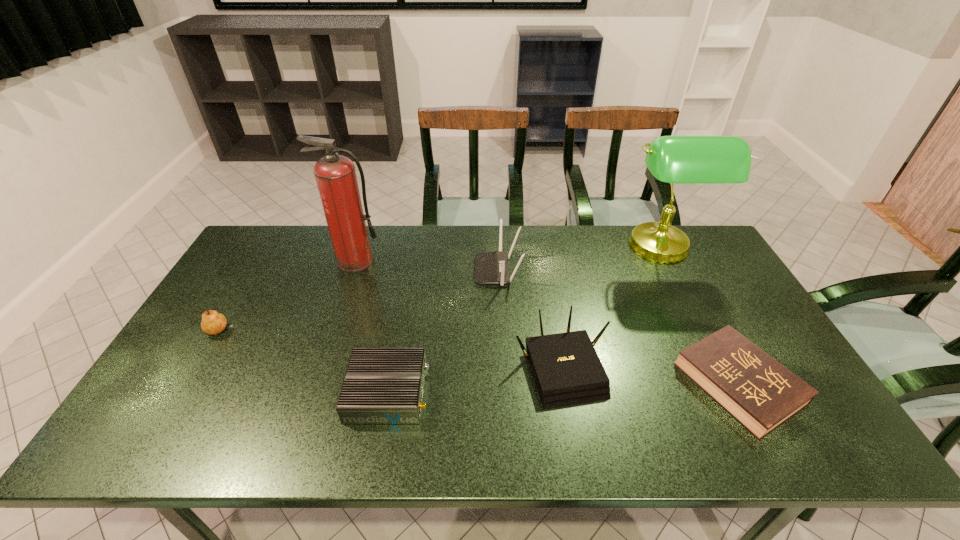
The height and width of the screenshot is (540, 960). Find the location of `object situated at the near right corner`. object situated at the near right corner is located at coordinates (761, 394).

Image resolution: width=960 pixels, height=540 pixels. I want to click on free location at the far edge of the desktop, so click(313, 231).

Where is `free location at the near edge`? free location at the near edge is located at coordinates click(x=297, y=421).

Find the location of a particular element. The width and height of the screenshot is (960, 540). blank space at the left edge of the desktop is located at coordinates (250, 272).

In the image, there is a desktop. At what (x,y) coordinates should I click in order to perform the action: click on vacant area at the far left corner. Please return your answer as a coordinate pair (x, y). Looking at the image, I should click on (258, 251).

Locate an element on the screen. The height and width of the screenshot is (540, 960). vacant region at the near left corner of the desktop is located at coordinates (174, 438).

Locate an element on the screen. vacant space in between the fire extinguisher and the third tallest object is located at coordinates (427, 266).

The image size is (960, 540). I want to click on vacant area between the fire extinguisher and the hardback book, so click(x=547, y=323).

This screenshot has height=540, width=960. Find the location of `vacant area that lies between the hardback book and the lamp`. vacant area that lies between the hardback book and the lamp is located at coordinates (699, 317).

This screenshot has width=960, height=540. In order to click on empty location between the shortest object and the fire extinguisher in this screenshot , I will do `click(547, 323)`.